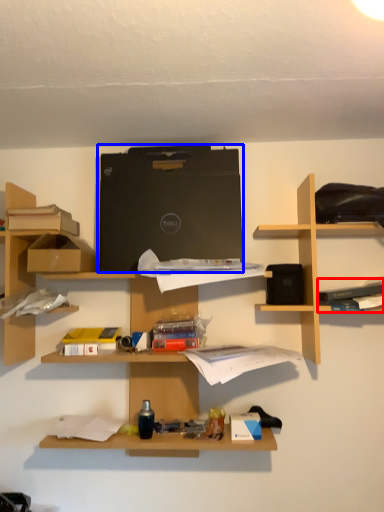
Question: Among these objects, which one is farthest to the camera, book (highlighted by a red box) or computer (highlighted by a blue box)?

Choices:
 (A) book
 (B) computer

Answer: (B)